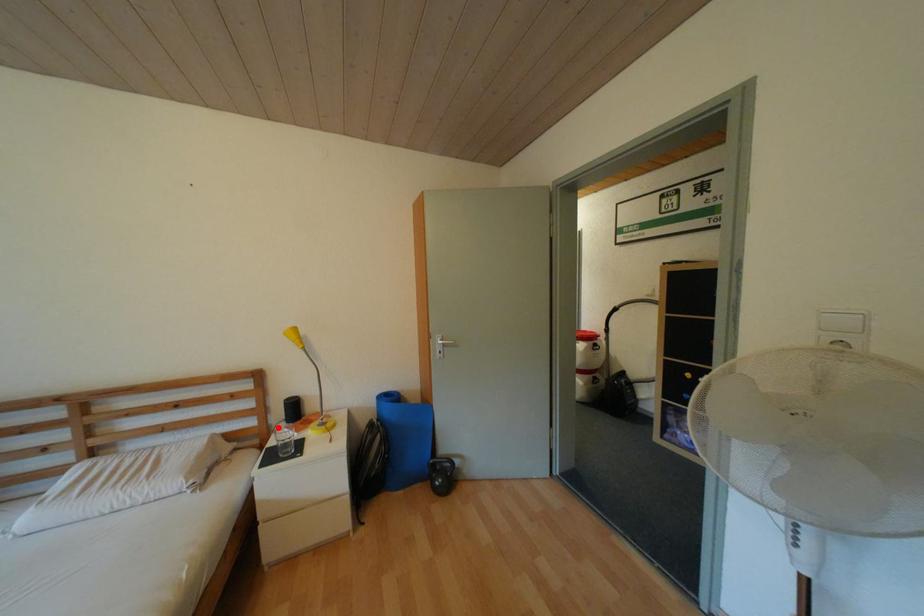
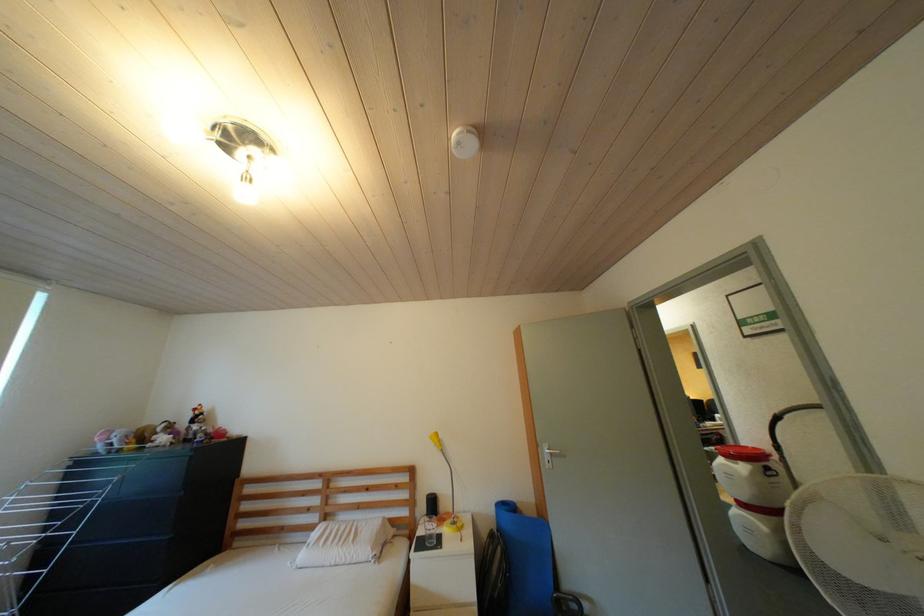
Question: I am providing you with two images of the same scene from different viewpoints. A red point is shown in image1. For the corresponding object point in image2, is it positioned nearer or farther from the camera?

Choices:
 (A) Nearer
 (B) Farther

Answer: (B)